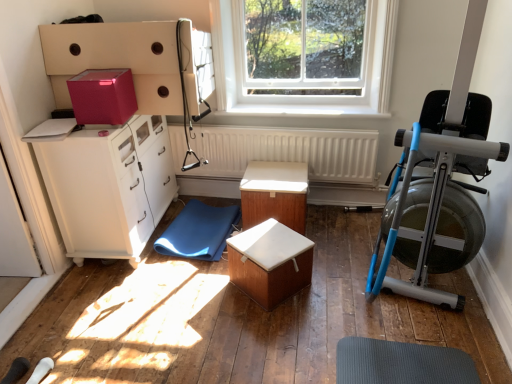
Question: In terms of height, does pink matte cardboard box at upper left look taller or shorter compared to white matte radiator at center?

Choices:
 (A) short
 (B) tall

Answer: (A)

Question: Does point (108, 114) appear closer or farther from the camera than point (231, 173)?

Choices:
 (A) farther
 (B) closer

Answer: (B)

Question: Which of these objects is positioned farthest from the pink matte cardboard box at upper left?

Choices:
 (A) transparent glass window at upper center
 (B) matte white cabinet at left
 (C) wooden table at center, arranged as the 1th table when viewed from the back
 (D) white matte radiator at center
 (E) wooden box at center, marked as the second table in a back-to-front arrangement

Answer: (A)

Question: Considering the real-world distances, which object is closest to the matte white cabinet at left?

Choices:
 (A) blue metallic rowing machine at right
 (B) transparent glass window at upper center
 (C) blue rubber yoga mat at lower center
 (D) white smooth window sill at center
 (E) pink matte cardboard box at upper left

Answer: (E)